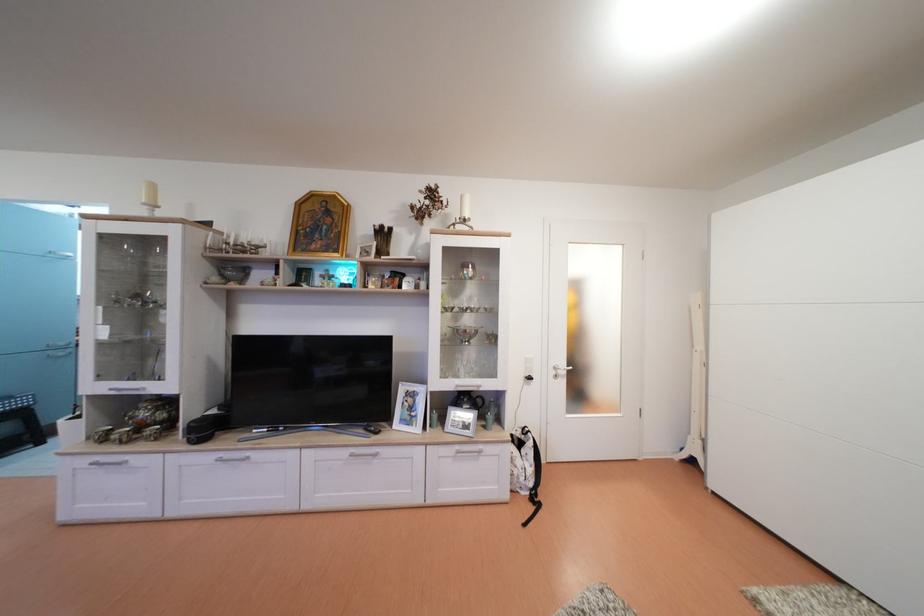
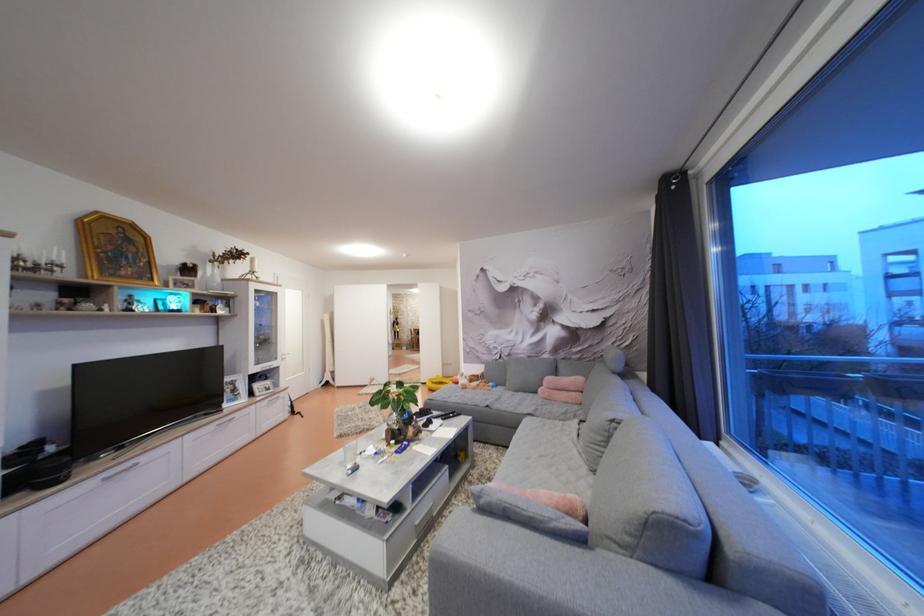
Locate, in the second image, the point that corresponds to point 249,450 in the first image.

(126, 466)